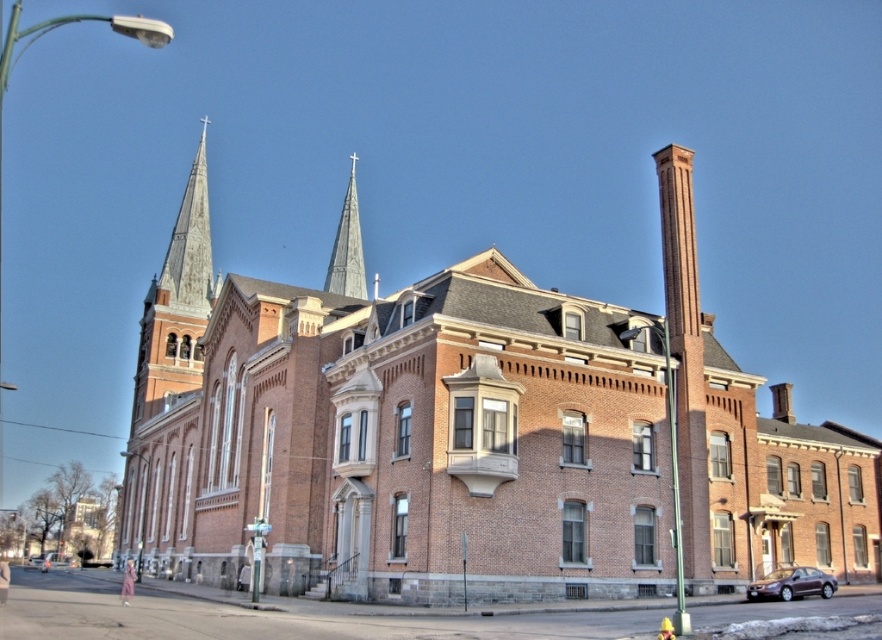
Question: Can you confirm if brick church at center is positioned above smooth gray steeple at center?

Choices:
 (A) no
 (B) yes

Answer: (A)

Question: Which point is farther from the camera taking this photo?

Choices:
 (A) (778, 582)
 (B) (353, 225)

Answer: (B)

Question: Which point is farther to the camera?

Choices:
 (A) (770, 576)
 (B) (271, 464)
 (C) (154, 397)
 (D) (47, 566)

Answer: (C)

Question: Does rusty metal spire at upper left have a greater width compared to metallic purple sedan at lower right?

Choices:
 (A) no
 (B) yes

Answer: (B)

Question: Can you confirm if brick church at center is bigger than smooth gray steeple at center?

Choices:
 (A) yes
 (B) no

Answer: (A)

Question: Which of the following is the farthest from the observer?

Choices:
 (A) smooth gray steeple at center
 (B) metallic purple sedan at lower right

Answer: (A)